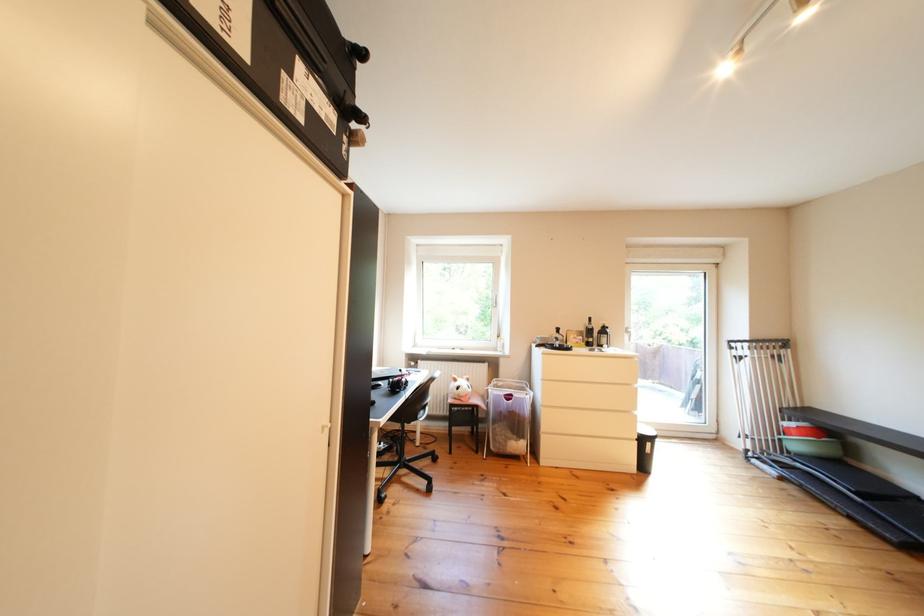
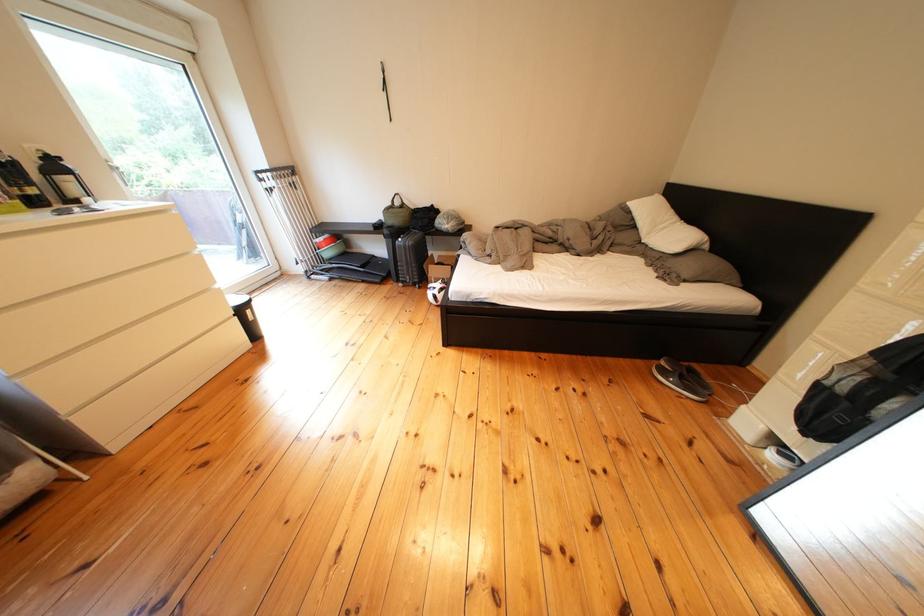
Find the pixel in the second image that matches (x=641, y=416) in the first image.

(220, 294)